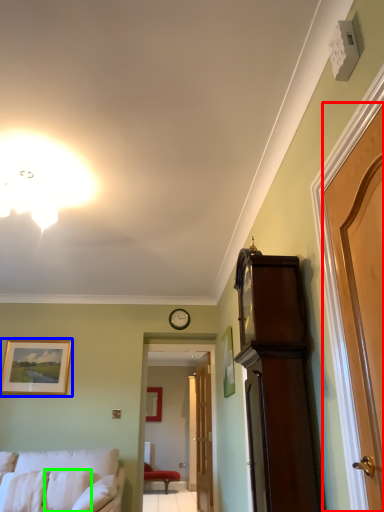
Question: Considering the real-world distances, which object is farthest from door (highlighted by a red box)? picture frame (highlighted by a blue box) or pillow (highlighted by a green box)?

Choices:
 (A) picture frame
 (B) pillow

Answer: (A)